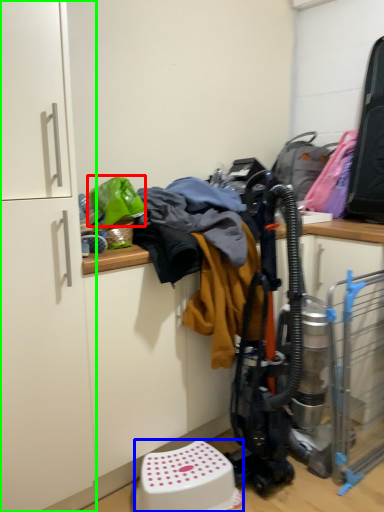
Question: Based on their relative distances, which object is nearer to clothing (highlighted by a red box)? Choose from step stool (highlighted by a blue box) and cabinetry (highlighted by a green box).

Choices:
 (A) step stool
 (B) cabinetry

Answer: (B)